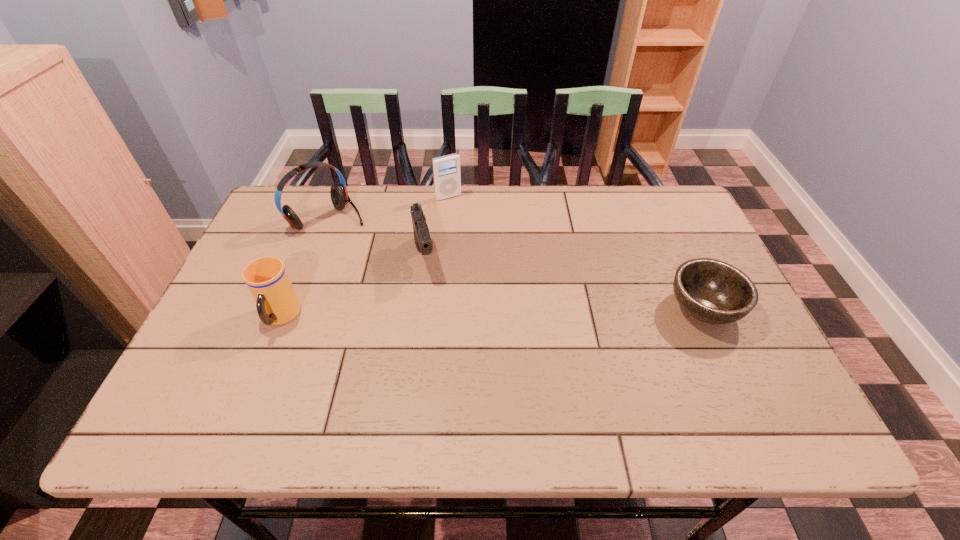
I want to click on headset located at the left edge, so click(338, 192).

Find the location of a particular element. object present at the right edge is located at coordinates (712, 291).

Where is `object that is at the far left corner`? This screenshot has width=960, height=540. object that is at the far left corner is located at coordinates (338, 192).

Where is `free space at the far edge`? The width and height of the screenshot is (960, 540). free space at the far edge is located at coordinates (424, 215).

At what (x,y) coordinates should I click in order to perform the action: click on free space at the near edge of the desktop. Please return your answer as a coordinate pair (x, y). Looking at the image, I should click on tap(290, 385).

Find the location of a particular element. This screenshot has width=960, height=540. free space at the left edge of the desktop is located at coordinates (225, 336).

In order to click on vacant space at the right edge of the desktop in this screenshot , I will do `click(740, 336)`.

Locate an element on the screen. vacant space at the far left corner of the desktop is located at coordinates (288, 229).

Identify the location of vacant region at the far right corner of the desktop. This screenshot has width=960, height=540. (663, 220).

Where is `empty space that is in between the shortest object and the cup`? empty space that is in between the shortest object and the cup is located at coordinates (492, 313).